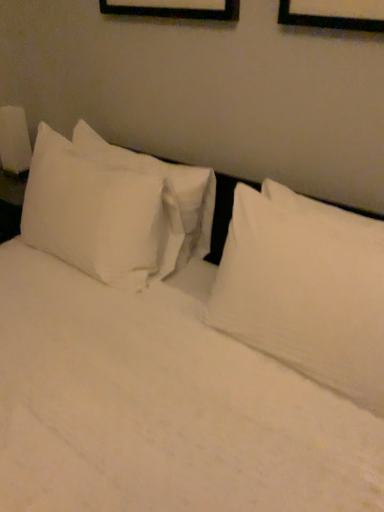
Question: Is the depth of white cotton pillow at left, which appears as the first pillow when viewed from the left, less than that of white soft pillow at upper right, which is the second pillow from left to right?

Choices:
 (A) no
 (B) yes

Answer: (A)

Question: From a real-world perspective, is white cotton pillow at left, which appears as the first pillow when viewed from the left, physically below white soft pillow at upper right, the 1th pillow positioned from the right?

Choices:
 (A) no
 (B) yes

Answer: (B)

Question: Does white cotton pillow at left, which appears as the first pillow when viewed from the left, have a greater height compared to white soft pillow at upper right, the 1th pillow positioned from the right?

Choices:
 (A) no
 (B) yes

Answer: (B)

Question: Does white cotton pillow at left, which appears as the first pillow when viewed from the left, have a lesser width compared to white soft pillow at upper right, which is the second pillow from left to right?

Choices:
 (A) no
 (B) yes

Answer: (A)

Question: Is white cotton pillow at left, placed as the second pillow when sorted from right to left, to the right of white soft pillow at upper right, which is the second pillow from left to right, from the viewer's perspective?

Choices:
 (A) no
 (B) yes

Answer: (A)

Question: From the image's perspective, is white cotton pillow at left, which appears as the first pillow when viewed from the left, below white soft pillow at upper right, which is the second pillow from left to right?

Choices:
 (A) no
 (B) yes

Answer: (A)

Question: From a real-world perspective, is white glossy lampshade at left beneath white soft pillow at upper right, which is the second pillow from left to right?

Choices:
 (A) yes
 (B) no

Answer: (A)

Question: Is there a large distance between white glossy lampshade at left and white soft pillow at upper right, which is the second pillow from left to right?

Choices:
 (A) no
 (B) yes

Answer: (B)

Question: Does white glossy lampshade at left appear on the right side of white soft pillow at upper right, which is the second pillow from left to right?

Choices:
 (A) yes
 (B) no

Answer: (B)

Question: Is white glossy lampshade at left behind white soft pillow at upper right, which is the second pillow from left to right?

Choices:
 (A) yes
 (B) no

Answer: (A)

Question: Is white glossy lampshade at left turned away from white soft pillow at upper right, the 1th pillow positioned from the right?

Choices:
 (A) yes
 (B) no

Answer: (B)

Question: Does white glossy lampshade at left come in front of white soft pillow at upper right, which is the second pillow from left to right?

Choices:
 (A) no
 (B) yes

Answer: (A)

Question: Could you tell me if white glossy lampshade at left is turned towards white cotton pillow at left, placed as the second pillow when sorted from right to left?

Choices:
 (A) yes
 (B) no

Answer: (B)